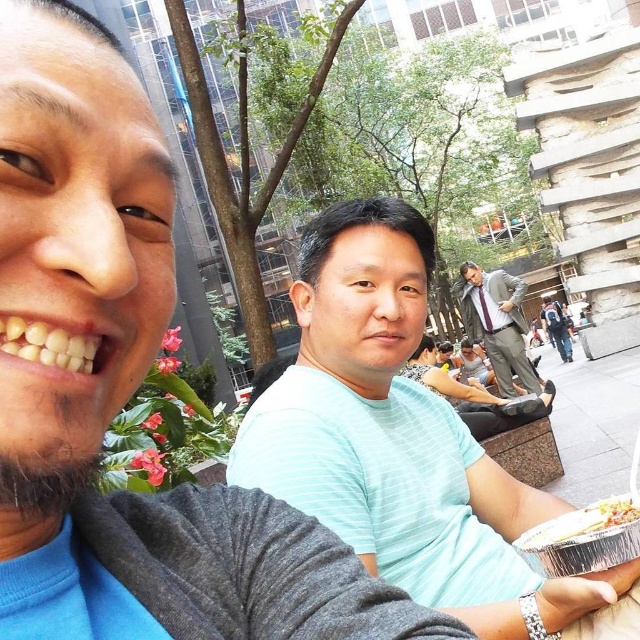
Question: Considering the relative positions of gray suit at center and silver foil tray at lower right in the image provided, where is gray suit at center located with respect to silver foil tray at lower right?

Choices:
 (A) above
 (B) below

Answer: (A)

Question: Which object is the farthest from the light blue striped shirt at center?

Choices:
 (A) gray suit at center
 (B) silver foil tray at lower right

Answer: (A)

Question: Estimate the real-world distances between objects in this image. Which object is farther from the silver foil tray at lower right?

Choices:
 (A) gray suit at center
 (B) light blue striped shirt at center

Answer: (A)

Question: Which of the following is the closest to the observer?

Choices:
 (A) gray suit at center
 (B) silver foil tray at lower right
 (C) light blue striped shirt at center

Answer: (B)

Question: Considering the relative positions of light blue striped shirt at center and silver foil tray at lower right in the image provided, where is light blue striped shirt at center located with respect to silver foil tray at lower right?

Choices:
 (A) above
 (B) below

Answer: (A)

Question: Is gray suit at center further to camera compared to silver foil tray at lower right?

Choices:
 (A) no
 (B) yes

Answer: (B)